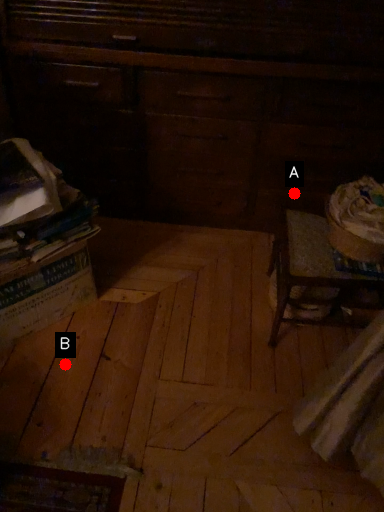
Question: Two points are circled on the image, labeled by A and B beside each circle. Which point is further to the camera?

Choices:
 (A) A is further
 (B) B is further

Answer: (A)